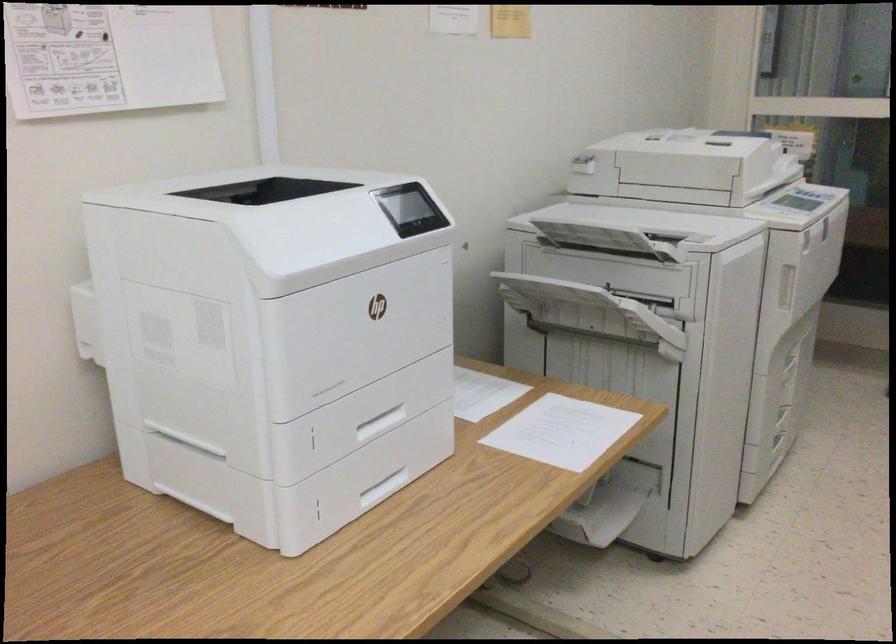
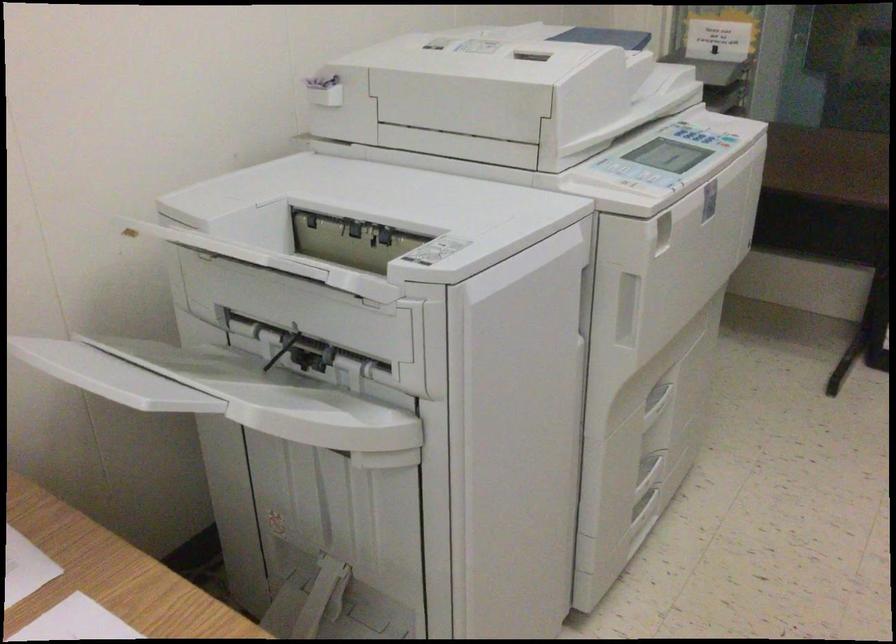
The point at (725, 363) is marked in the first image. Where is the corresponding point in the second image?

(506, 453)